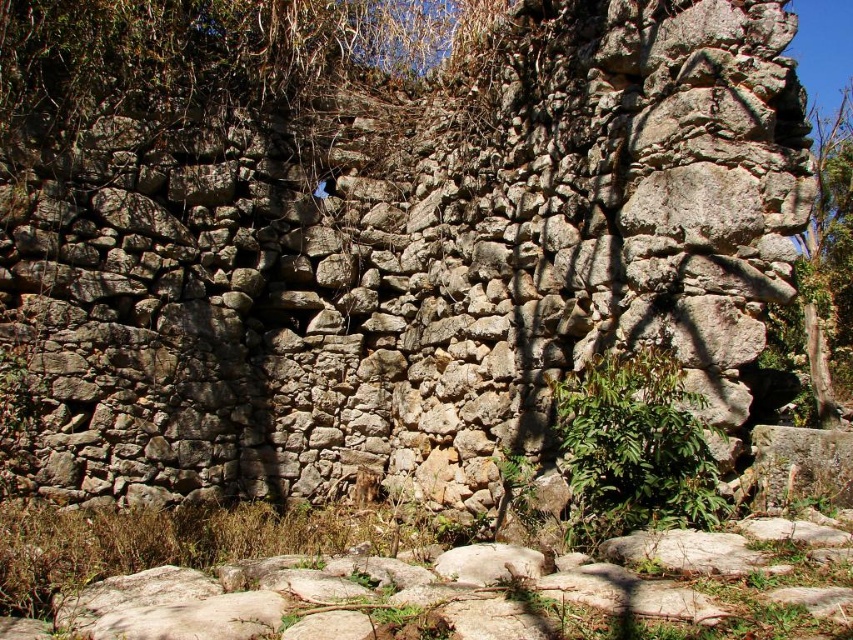
Question: Can you confirm if brown rough stone wall at upper center is wider than green leafy plant at center?

Choices:
 (A) no
 (B) yes

Answer: (B)

Question: Among these points, which one is farthest from the camera?

Choices:
 (A) (688, 508)
 (B) (109, 76)

Answer: (B)

Question: Does brown rough stone wall at upper center have a greater width compared to green leafy plant at center?

Choices:
 (A) no
 (B) yes

Answer: (B)

Question: Is brown rough stone wall at upper center bigger than green leafy plant at center?

Choices:
 (A) yes
 (B) no

Answer: (A)

Question: Which object is closer to the camera taking this photo?

Choices:
 (A) brown rough stone wall at upper center
 (B) green leafy plant at center

Answer: (B)